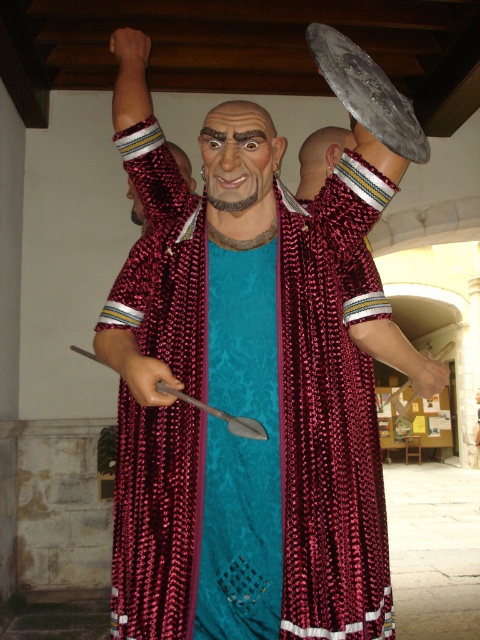
Which is more to the left, shiny red cape at center or matte plastic head at center?

matte plastic head at center is more to the left.

Which of these two, shiny red cape at center or matte plastic head at center, stands taller?

shiny red cape at center

Is point (299, 508) behind point (264, 147)?

No, it is in front of (264, 147).

I want to click on shiny red cape at center, so click(x=283, y=317).

Can you confirm if matte plastic head at center is positioned above metallic sheen sword at lower center?

Correct, matte plastic head at center is located above metallic sheen sword at lower center.

In order to click on matte plastic head at center in this screenshot , I will do `click(240, 163)`.

Locate an element on the screen. Image resolution: width=480 pixels, height=640 pixels. matte plastic head at center is located at coordinates (240, 163).

How far apart are shiny red cape at center and matte gold earring at upper center?

A distance of 1.05 meters exists between shiny red cape at center and matte gold earring at upper center.

Between point (183, 461) and point (303, 172), which one is positioned in front?

Point (183, 461)

Identify the location of shiny red cape at center. This screenshot has height=640, width=480. (283, 317).

The width and height of the screenshot is (480, 640). Identify the location of shiny red cape at center. (283, 317).